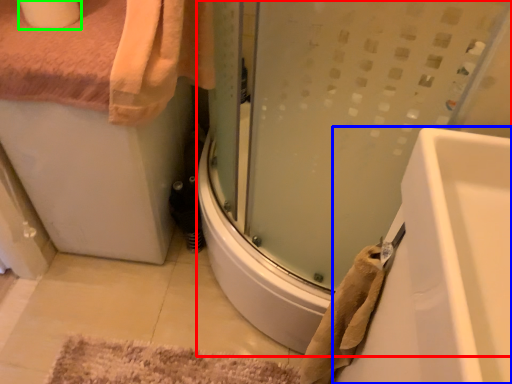
Question: Which object is positioned closest to shower door (highlighted by a red box)? Select from bathtub (highlighted by a blue box) and toilet paper (highlighted by a green box).

Choices:
 (A) bathtub
 (B) toilet paper

Answer: (A)